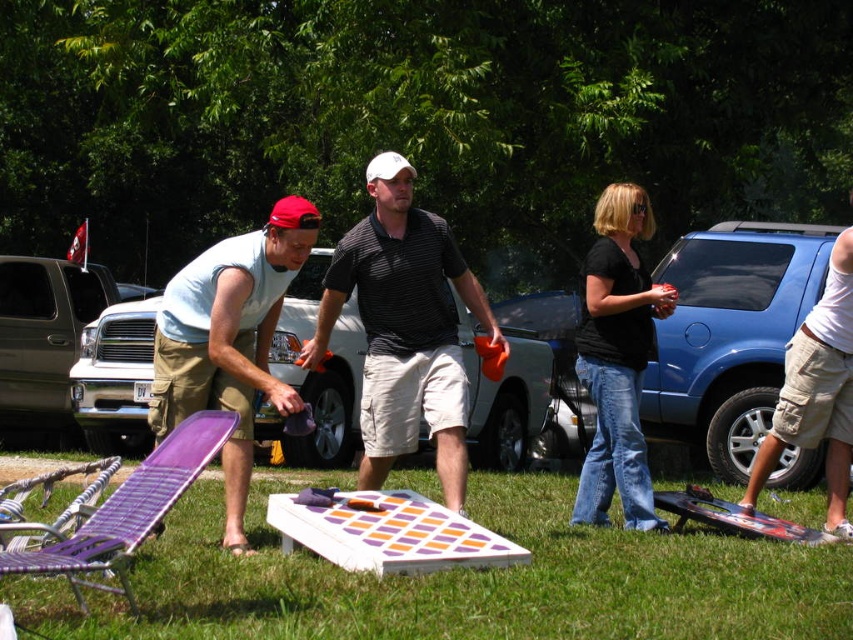
Is green grass at center positioned in front of matte light blue tank top at left?

Yes, it is.

Identify the location of green grass at center. (463, 580).

Find the location of `green grass at center`. green grass at center is located at coordinates (463, 580).

Is green grass at center to the left of black cotton shirt at center from the viewer's perspective?

Correct, you'll find green grass at center to the left of black cotton shirt at center.

The image size is (853, 640). What do you see at coordinates (463, 580) in the screenshot?
I see `green grass at center` at bounding box center [463, 580].

Identify the location of green grass at center. (463, 580).

Who is more forward, (238, 406) or (708, 512)?

Point (238, 406)

Does matte light blue tank top at left appear on the left side of black textured skateboard at lower right?

Correct, you'll find matte light blue tank top at left to the left of black textured skateboard at lower right.

The image size is (853, 640). In order to click on matte light blue tank top at left in this screenshot , I will do click(229, 340).